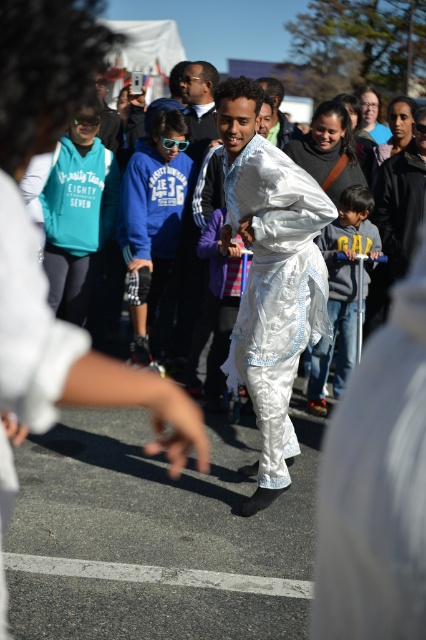
You are a photographer trying to capture both the shiny silver robe at center and the dark gray sweater at center in a single frame. Which object should you adjust your camera angle to ensure it fits better in the frame?

The shiny silver robe at center might be wider than dark gray sweater at center, so adjusting the camera angle to accommodate the width of the shiny silver robe at center would ensure both objects fit better in the frame.

You are a photographer standing at the edge of the crowd. You want to take a photo that includes both the shiny silver robe at center and the dark gray sweater at center. What is the minimum distance you need to step back to ensure both are in frame?

The shiny silver robe at center and dark gray sweater at center are 1.46 meters apart. To ensure both are in frame, you need to step back at least 1.46 meters so that the camera can capture the full distance between them.

You are standing at the back of the crowd watching the parade. You see both the blue fleece hoodie at center and the dark gray sweater at center. Which one is closer to you?

The blue fleece hoodie at center is closer to you because it is further to the viewer than the dark gray sweater at center.